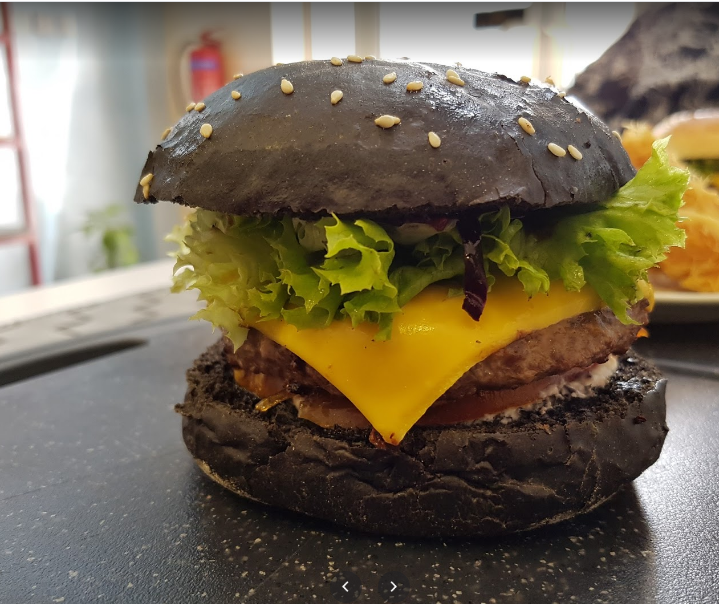
In order to click on green plant in corner of back wall in this screenshot , I will do `click(111, 241)`.